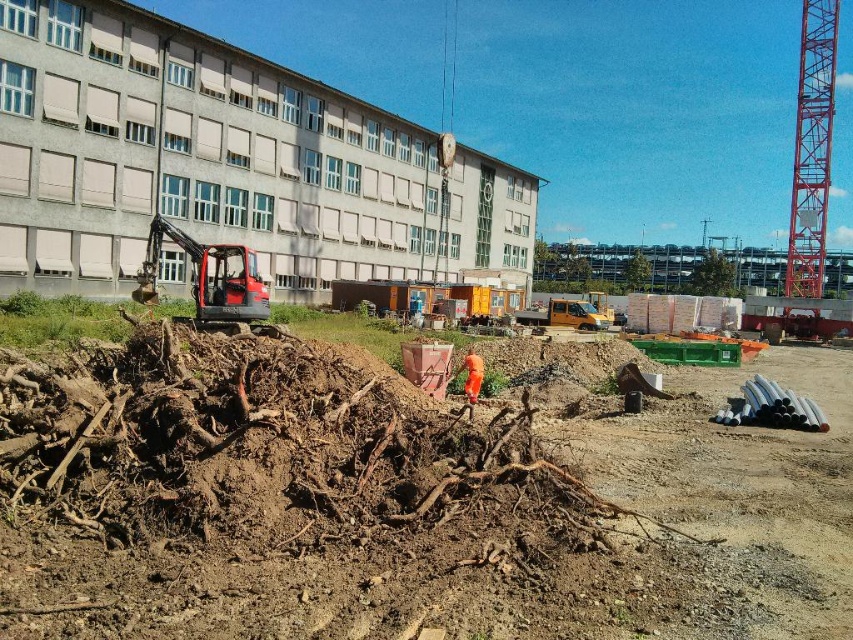
Looking at this image, is brown earthy dirt at center positioned in front of orange fabric construction worker at center?

That is True.

What do you see at coordinates (421, 513) in the screenshot? This screenshot has height=640, width=853. I see `brown earthy dirt at center` at bounding box center [421, 513].

The image size is (853, 640). In order to click on brown earthy dirt at center in this screenshot , I will do `click(421, 513)`.

Which is behind, point (689, 486) or point (822, 124)?

The point (822, 124) is more distant.

From the picture: Which is below, brown earthy dirt at center or red metallic tower crane at right?

brown earthy dirt at center is below.

Who is more forward, (196, 556) or (801, 24)?

Point (196, 556) is more forward.

Locate an element on the screen. The height and width of the screenshot is (640, 853). brown earthy dirt at center is located at coordinates (421, 513).

Can you confirm if matte black excavator at center is shorter than orange fabric construction worker at center?

No, matte black excavator at center is not shorter than orange fabric construction worker at center.

Is point (149, 262) behind point (477, 388)?

That is True.

Is point (218, 243) behind point (469, 365)?

Yes, point (218, 243) is behind point (469, 365).

Identify the location of matte black excavator at center. (207, 276).